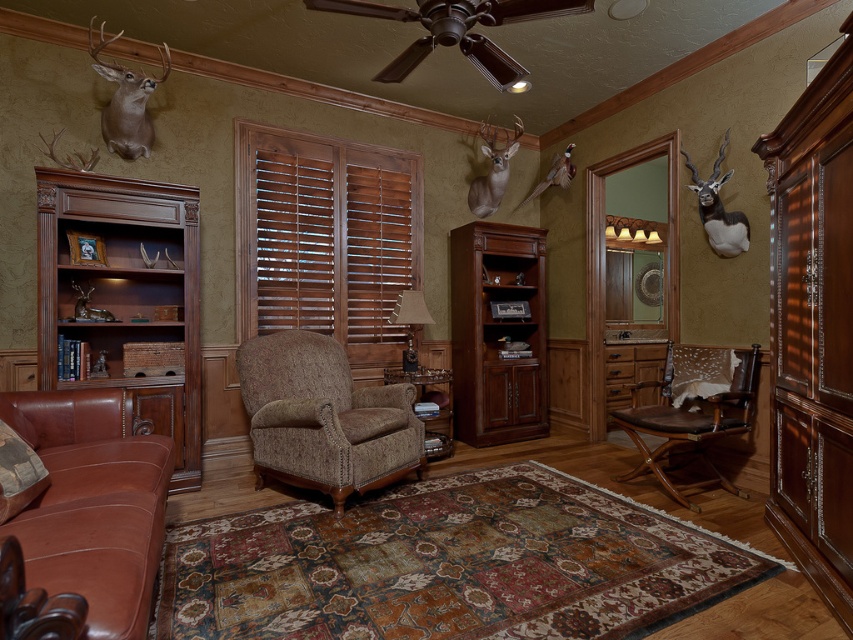
Question: Can you confirm if polished wood bookshelf at left is wider than textured brown armchair at center?

Choices:
 (A) no
 (B) yes

Answer: (A)

Question: Is polished wood bookshelf at left in front of brown leather armchair at lower right?

Choices:
 (A) no
 (B) yes

Answer: (B)

Question: Among these objects, which one is nearest to the camera?

Choices:
 (A) textured brown armchair at center
 (B) brown leather armchair at lower right
 (C) polished wood bookshelf at left

Answer: (A)

Question: Which is farther from the wooden shutters at center?

Choices:
 (A) brown leather armchair at lower right
 (B) textured brown armchair at center

Answer: (A)

Question: Does polished wood bookshelf at left have a larger size compared to mahogany wood bookshelf at center?

Choices:
 (A) yes
 (B) no

Answer: (A)

Question: Estimate the real-world distances between objects in this image. Which object is farther from the brown leather armchair at lower right?

Choices:
 (A) textured brown armchair at center
 (B) mahogany wood bookshelf at center

Answer: (A)